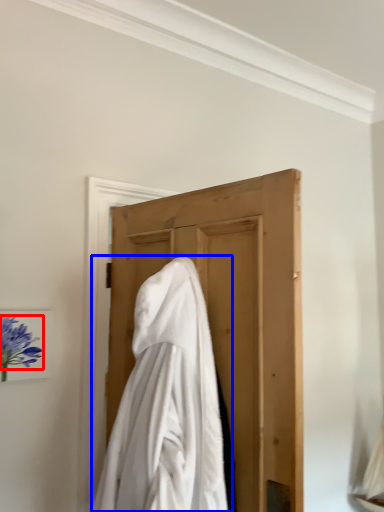
Question: Among these objects, which one is nearest to the camera, flower (highlighted by a red box) or cloak (highlighted by a blue box)?

Choices:
 (A) flower
 (B) cloak

Answer: (B)